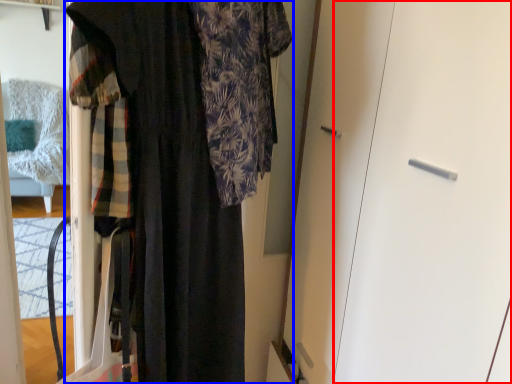
Question: Which object is closer to the camera taking this photo, screen door (highlighted by a red box) or fancy dress (highlighted by a blue box)?

Choices:
 (A) screen door
 (B) fancy dress

Answer: (B)